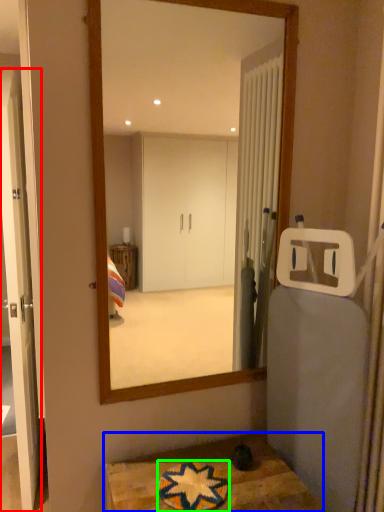
Question: Which is nearer to the door (highlighted by a red box)? table (highlighted by a blue box) or bath mat (highlighted by a green box).

Choices:
 (A) table
 (B) bath mat

Answer: (A)